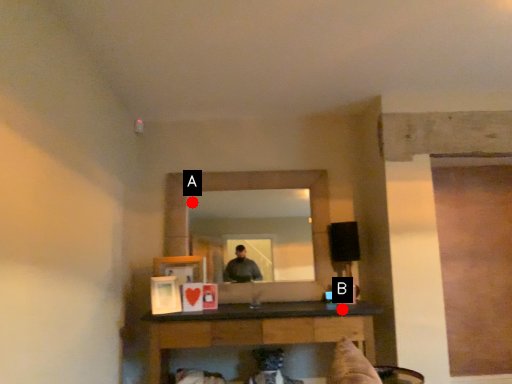
Question: Two points are circled on the image, labeled by A and B beside each circle. Which point is closer to the camera taking this photo?

Choices:
 (A) A is closer
 (B) B is closer

Answer: (B)